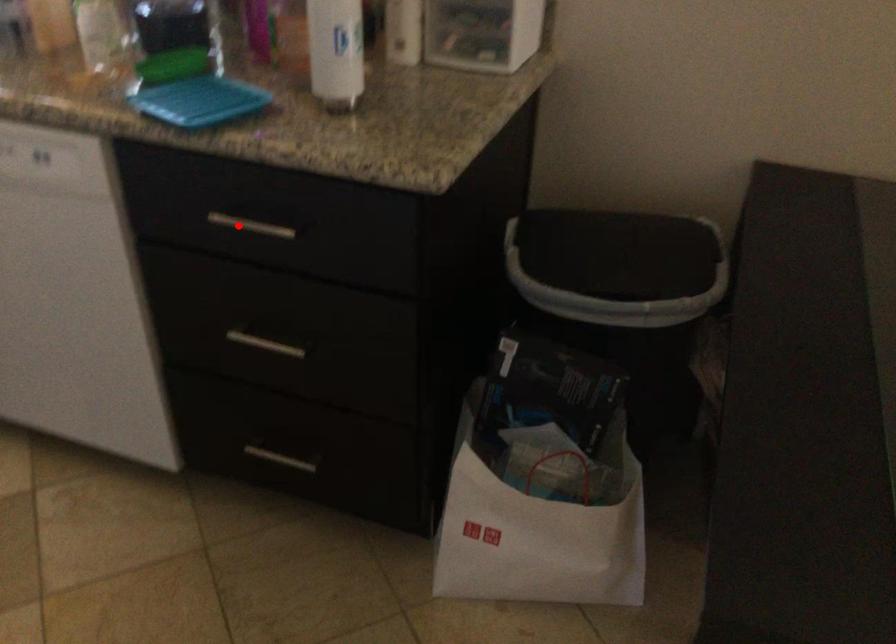
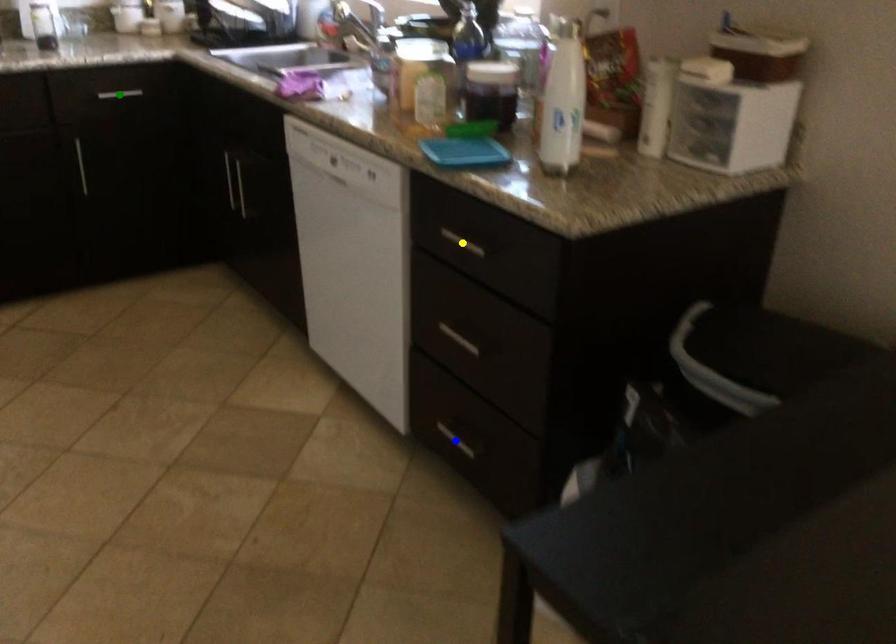
Question: I am providing you with two images of the same scene from different viewpoints. A red point is marked on the first image. You are given multiple points on the second image. Which point in image 2 represents the same 3d spot as the red point in image 1?

Choices:
 (A) yellow point
 (B) green point
 (C) blue point

Answer: (A)